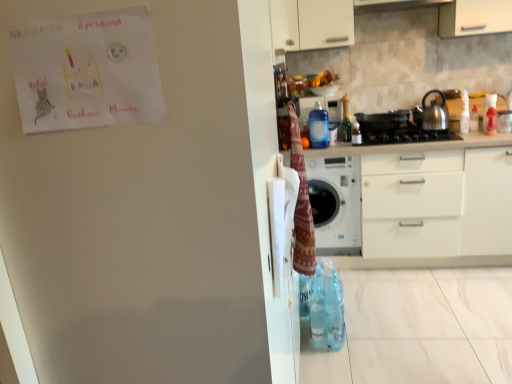
Question: Are satin black gas stove at center and knitted woolen blanket at upper right far apart?

Choices:
 (A) yes
 (B) no

Answer: (A)

Question: From a real-world perspective, is satin black gas stove at center positioned under knitted woolen blanket at upper right based on gravity?

Choices:
 (A) no
 (B) yes

Answer: (B)

Question: Is satin black gas stove at center touching knitted woolen blanket at upper right?

Choices:
 (A) no
 (B) yes

Answer: (A)

Question: Can we say satin black gas stove at center lies outside knitted woolen blanket at upper right?

Choices:
 (A) no
 (B) yes

Answer: (B)

Question: Does satin black gas stove at center have a lesser height compared to knitted woolen blanket at upper right?

Choices:
 (A) no
 (B) yes

Answer: (B)

Question: Do you think satin black gas stove at center is within satin silver kettle at right, or outside of it?

Choices:
 (A) inside
 (B) outside

Answer: (B)

Question: Considering the positions of satin black gas stove at center and satin silver kettle at right in the image, is satin black gas stove at center wider or thinner than satin silver kettle at right?

Choices:
 (A) wide
 (B) thin

Answer: (A)

Question: Considering the relative positions of satin black gas stove at center and satin silver kettle at right in the image provided, is satin black gas stove at center to the left or to the right of satin silver kettle at right?

Choices:
 (A) right
 (B) left

Answer: (B)

Question: From the image's perspective, relative to satin silver kettle at right, is satin black gas stove at center above or below?

Choices:
 (A) below
 (B) above

Answer: (A)

Question: From their relative heights in the image, would you say transparent plastic spray bottle at upper right, which is the 3th bottle from left to right, is taller or shorter than transparent plastic bottle at upper center, marked as the fourth bottle in a right-to-left arrangement?

Choices:
 (A) tall
 (B) short

Answer: (B)

Question: Is transparent plastic spray bottle at upper right, which is the 3th bottle from left to right, in front of or behind transparent plastic bottle at upper center, positioned as the first bottle in left-to-right order, in the image?

Choices:
 (A) front
 (B) behind

Answer: (B)

Question: Based on their positions, is transparent plastic spray bottle at upper right, which is the 3th bottle from left to right, located to the left or right of transparent plastic bottle at upper center, marked as the fourth bottle in a right-to-left arrangement?

Choices:
 (A) left
 (B) right

Answer: (B)

Question: From the image's perspective, is transparent plastic spray bottle at upper right, which is the 3th bottle from left to right, located above or below transparent plastic bottle at upper center, positioned as the first bottle in left-to-right order?

Choices:
 (A) above
 (B) below

Answer: (A)

Question: From the image's perspective, is transparent plastic spray bottle at upper right, the second bottle from the right, positioned above or below translucent plastic bottle at upper right, which is the 2th bottle from left to right?

Choices:
 (A) above
 (B) below

Answer: (B)

Question: Do you think transparent plastic spray bottle at upper right, which is the 3th bottle from left to right, is within translucent plastic bottle at upper right, which is the 2th bottle from left to right, or outside of it?

Choices:
 (A) inside
 (B) outside

Answer: (B)